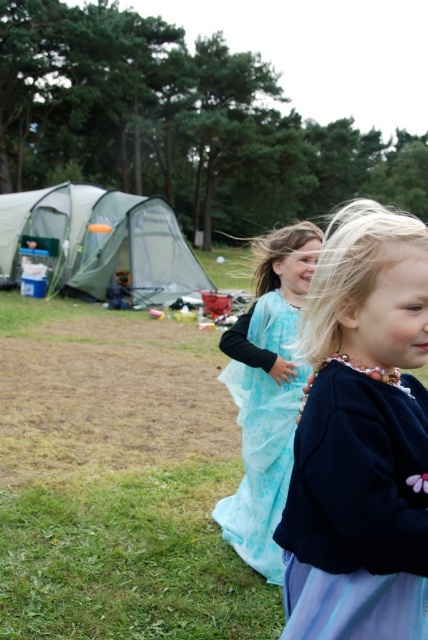
Question: Does green grass at lower left come behind green fabric tent at left?

Choices:
 (A) yes
 (B) no

Answer: (B)

Question: Among these objects, which one is nearest to the camera?

Choices:
 (A) green grass at lower left
 (B) light blue silky dress at center
 (C) green fabric tent at left
 (D) blue satin dress at center

Answer: (D)

Question: Can you confirm if green fabric tent at left is smaller than light blue silky dress at center?

Choices:
 (A) yes
 (B) no

Answer: (B)

Question: Based on their relative distances, which object is nearer to the green fabric tent at left?

Choices:
 (A) green grass at lower left
 (B) light blue silky dress at center

Answer: (A)

Question: Among these points, which one is farthest from the camera?

Choices:
 (A) (261, 300)
 (B) (5, 272)
 (C) (354, 371)

Answer: (B)

Question: Is green grass at lower left positioned in front of light blue silky dress at center?

Choices:
 (A) no
 (B) yes

Answer: (B)